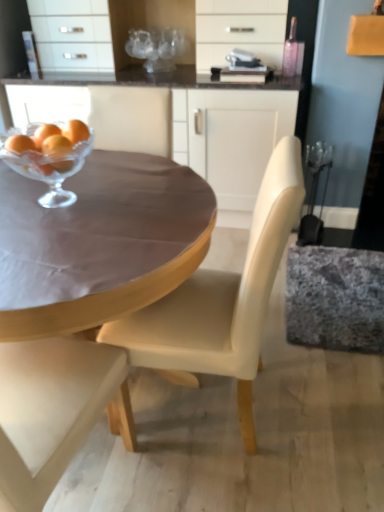
The height and width of the screenshot is (512, 384). In order to click on free region under clear glass bowl at center (from a real-world perspective) in this screenshot , I will do `click(60, 193)`.